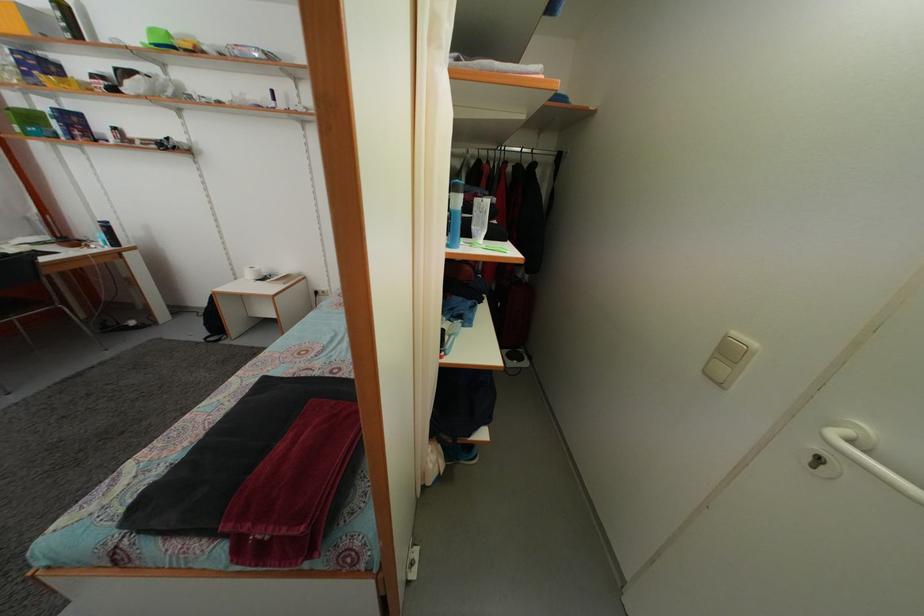
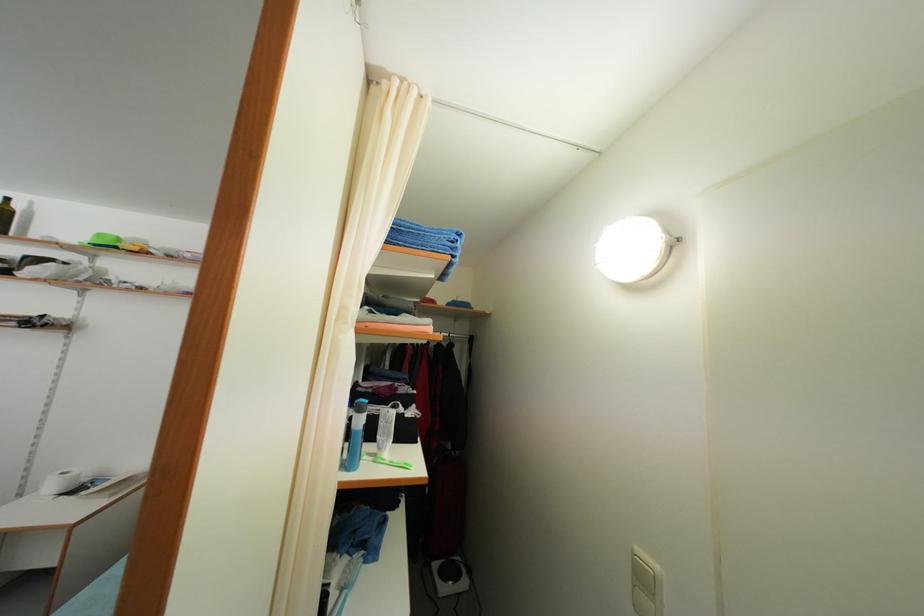
In the second image, find the point that corresponds to pixel 479 235 in the first image.

(383, 445)